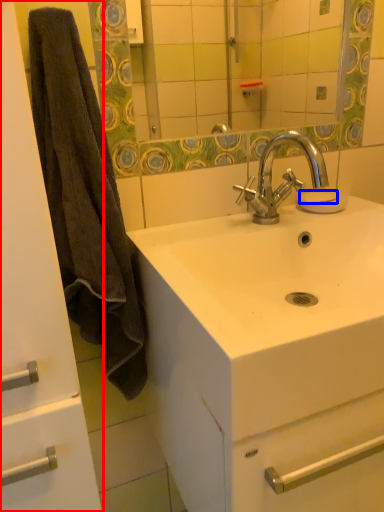
Question: Which object appears farthest to the camera in this image, bathroom cabinet (highlighted by a red box) or soap (highlighted by a blue box)?

Choices:
 (A) bathroom cabinet
 (B) soap

Answer: (B)